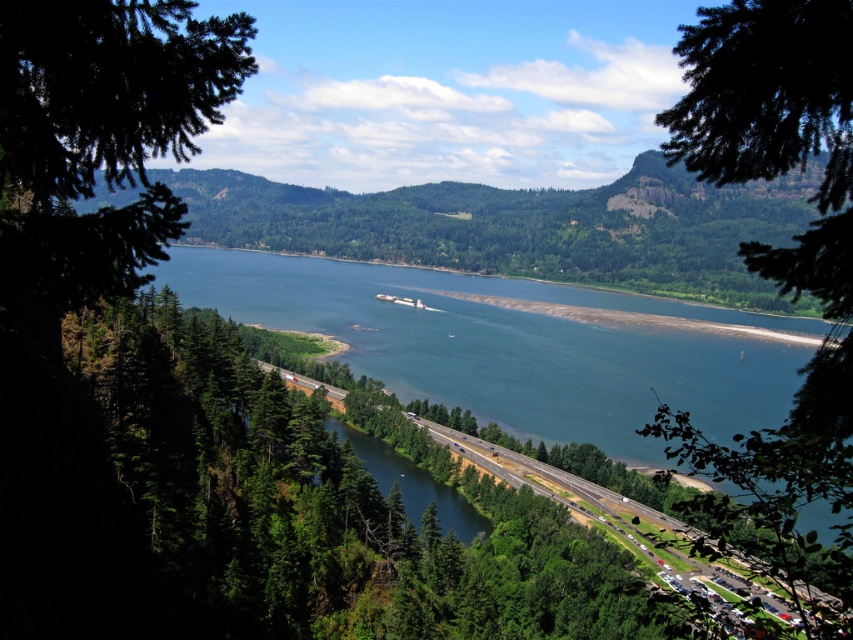
Question: Among these points, which one is farthest from the camera?

Choices:
 (A) (670, 358)
 (B) (805, 250)

Answer: (A)

Question: Does blue-green water at center have a larger size compared to green leafy tree at upper center?

Choices:
 (A) no
 (B) yes

Answer: (B)

Question: Which of the following is the closest to the observer?

Choices:
 (A) green leafy tree at upper center
 (B) blue-green water at center

Answer: (A)

Question: Which point is farther to the camera?

Choices:
 (A) (732, 432)
 (B) (775, 147)

Answer: (A)

Question: Is blue-green water at center smaller than green leafy tree at upper center?

Choices:
 (A) yes
 (B) no

Answer: (B)

Question: Does blue-green water at center appear on the right side of green leafy tree at upper center?

Choices:
 (A) no
 (B) yes

Answer: (A)